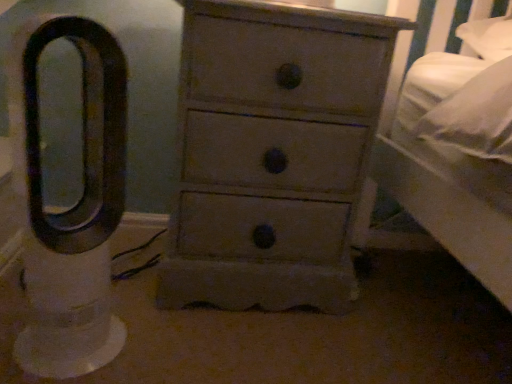
The height and width of the screenshot is (384, 512). In order to click on free space to the back side of white plastic fan at left in this screenshot , I will do [x=132, y=300].